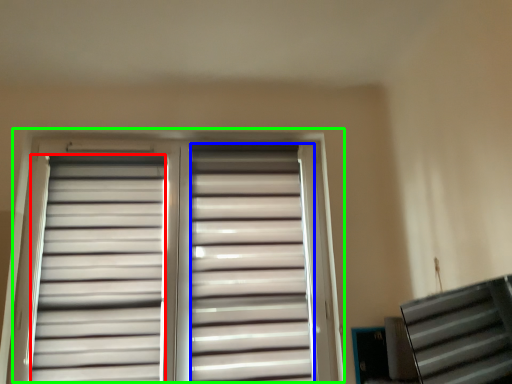
Question: Which is farther away from shutter (highlighted by a red box)? shutter (highlighted by a blue box) or window (highlighted by a green box)?

Choices:
 (A) shutter
 (B) window

Answer: (A)